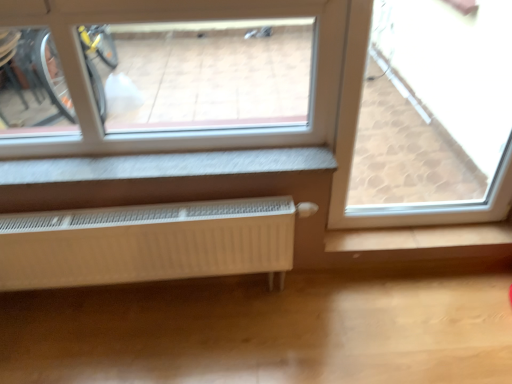
Identify the location of free space in front of white matte radiator at lower center. (147, 347).